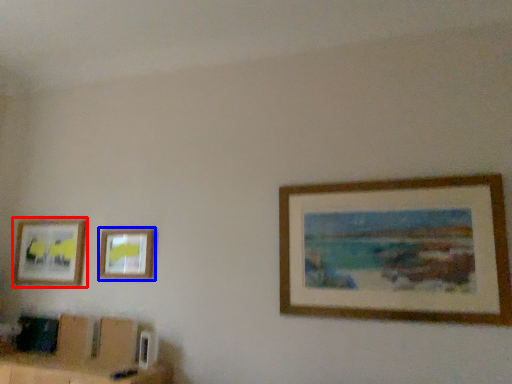
Question: Among these objects, which one is farthest to the camera, picture frame (highlighted by a red box) or picture frame (highlighted by a blue box)?

Choices:
 (A) picture frame
 (B) picture frame

Answer: (A)